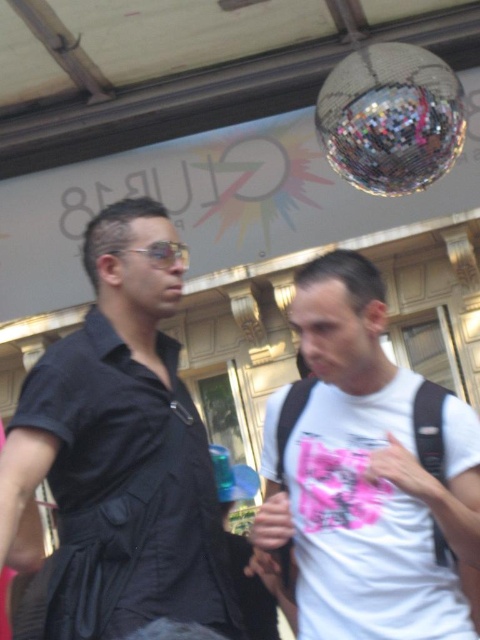
You are standing at the point with coordinates point (120,451). You want to walk to the disco ball hanging above the individuals. Which direction should you move relative to the black matte shirt at left?

The point (120,451) corresponds to the black matte shirt at left. To reach the disco ball hanging above the individuals, you should move upward from the black matte shirt at left since the disco ball is positioned above them.